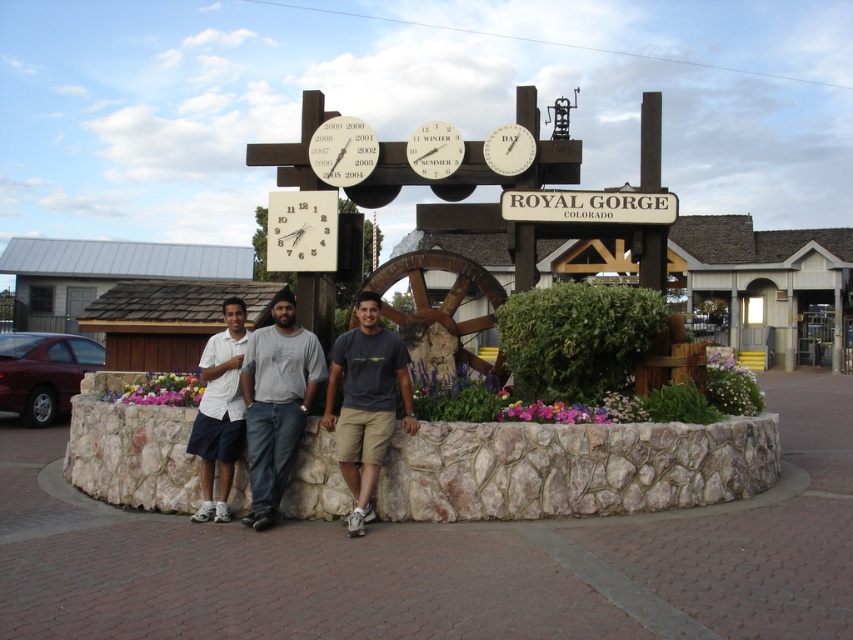
Question: Which is farther from the light gray cotton shirt at center?

Choices:
 (A) dark gray t-shirt at center
 (B) matte white clock at upper center
 (C) denim jeans at center

Answer: (B)

Question: Is denim jeans at center positioned behind white plastic clock at center?

Choices:
 (A) yes
 (B) no

Answer: (B)

Question: Is white cotton shirt at center below matte white clock at center?

Choices:
 (A) yes
 (B) no

Answer: (A)

Question: Which point is closer to the camera taking this photo?

Choices:
 (A) (212, 419)
 (B) (374, 154)
 (C) (633, 211)
 (D) (514, 131)

Answer: (A)

Question: Which point is farther to the camera?

Choices:
 (A) (514, 202)
 (B) (521, 132)

Answer: (B)

Question: Does dark gray t-shirt at center have a larger size compared to white cotton shirt at center?

Choices:
 (A) yes
 (B) no

Answer: (A)